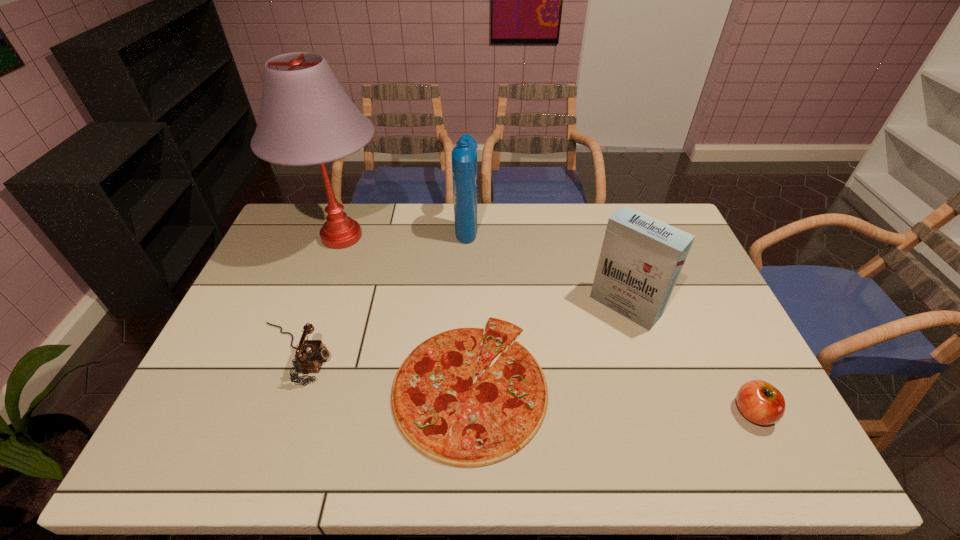
Identify the location of table lamp. The width and height of the screenshot is (960, 540). (306, 118).

Where is `the second tallest object`? The width and height of the screenshot is (960, 540). the second tallest object is located at coordinates (464, 155).

Image resolution: width=960 pixels, height=540 pixels. I want to click on cigarette case, so click(x=641, y=258).

This screenshot has width=960, height=540. In order to click on the fourth shortest object in this screenshot , I will do point(641,258).

In order to click on telephone in this screenshot , I will do `click(310, 354)`.

The image size is (960, 540). I want to click on apple, so click(760, 402).

Locate an element on the screen. The image size is (960, 540). the shortest object is located at coordinates pyautogui.click(x=440, y=412).

At what (x,y) coordinates should I click in order to perform the action: click on vacant region located 0.080m on the front-facing side of the tallest object. Please return your answer as a coordinate pair (x, y). This screenshot has width=960, height=540. Looking at the image, I should click on (414, 237).

At what (x,y) coordinates should I click in order to perform the action: click on vacant space located 0.090m on the left of the second tallest object. Please return your answer as a coordinate pair (x, y). The image size is (960, 540). Looking at the image, I should click on (431, 226).

Find the location of a particular element. free space located 0.150m on the front of the fifth object from left to right is located at coordinates (648, 376).